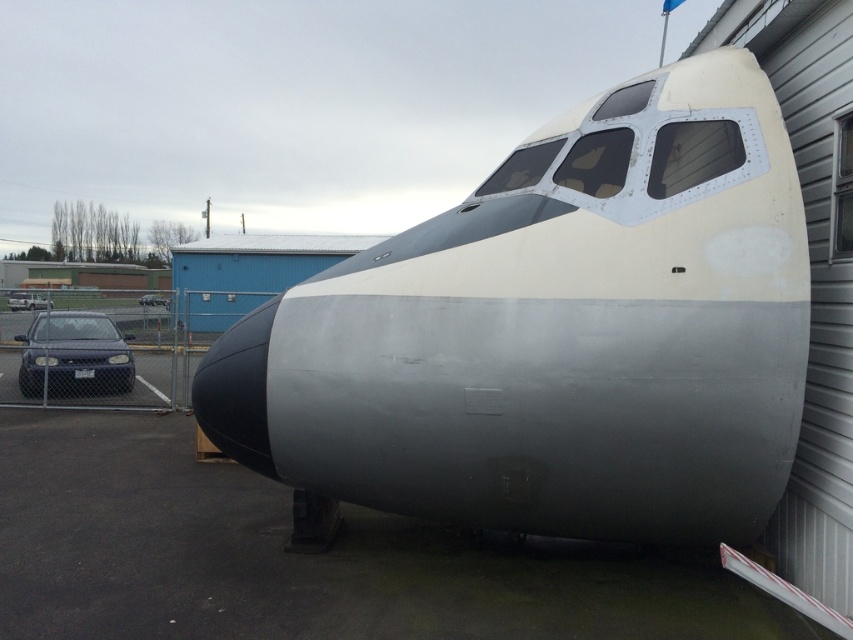
Who is more distant from viewer, (16, 294) or (158, 292)?

The point (158, 292) is more distant.

Does point (36, 294) lie in front of point (143, 298)?

That is True.

Which is in front, point (50, 300) or point (144, 292)?

Point (50, 300)

I want to click on matte black car at left, so click(27, 300).

Does matte gray airplane at center appear under matte black car at left?

Yes.

Which is above, matte gray airplane at center or matte black car at left?

matte black car at left is above.

Does point (611, 97) come behind point (28, 300)?

No, it is not.

Where is `matte gray airplane at center`? matte gray airplane at center is located at coordinates (554, 333).

Who is more distant from viewer, [434,300] or [22,368]?

The point [22,368] is behind.

Is matte gray airplane at center above matte blue car at lower left?

Yes, matte gray airplane at center is above matte blue car at lower left.

This screenshot has height=640, width=853. What do you see at coordinates (554, 333) in the screenshot? I see `matte gray airplane at center` at bounding box center [554, 333].

What are the coordinates of `matte gray airplane at center` in the screenshot? It's located at (554, 333).